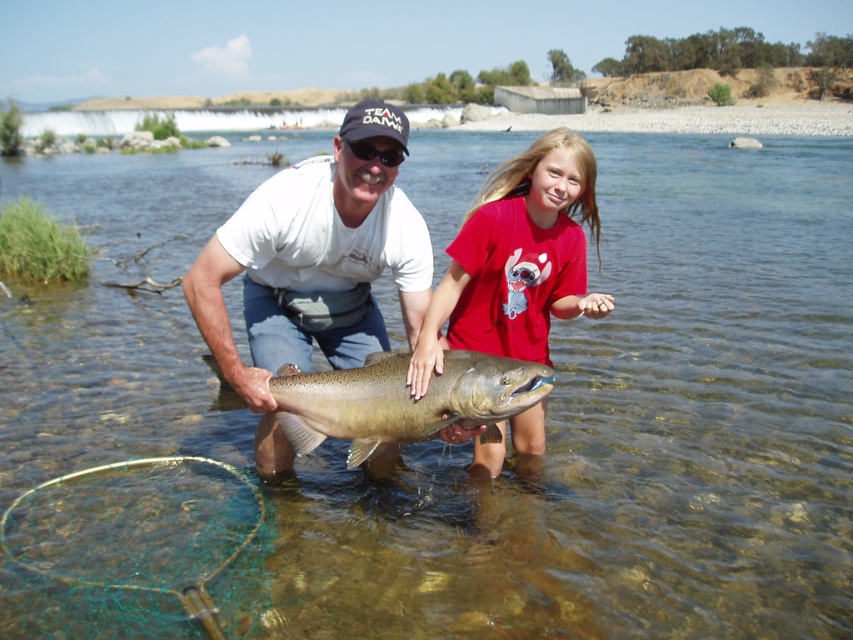
Question: Which of the following is the closest to the observer?

Choices:
 (A) matte white shirt at center
 (B) matte red t-shirt at center
 (C) shiny silver fish at center

Answer: (C)

Question: Which object appears closest to the camera in this image?

Choices:
 (A) shiny silver fish at center
 (B) matte red t-shirt at center

Answer: (A)

Question: Does matte white shirt at center have a lesser width compared to matte red t-shirt at center?

Choices:
 (A) no
 (B) yes

Answer: (A)

Question: From the image, what is the correct spatial relationship of matte white shirt at center in relation to shiny silver fish at center?

Choices:
 (A) left
 (B) right

Answer: (A)

Question: Based on their relative distances, which object is nearer to the matte red t-shirt at center?

Choices:
 (A) shiny silver fish at center
 (B) matte white shirt at center

Answer: (A)

Question: Is matte red t-shirt at center smaller than shiny silver fish at center?

Choices:
 (A) yes
 (B) no

Answer: (B)